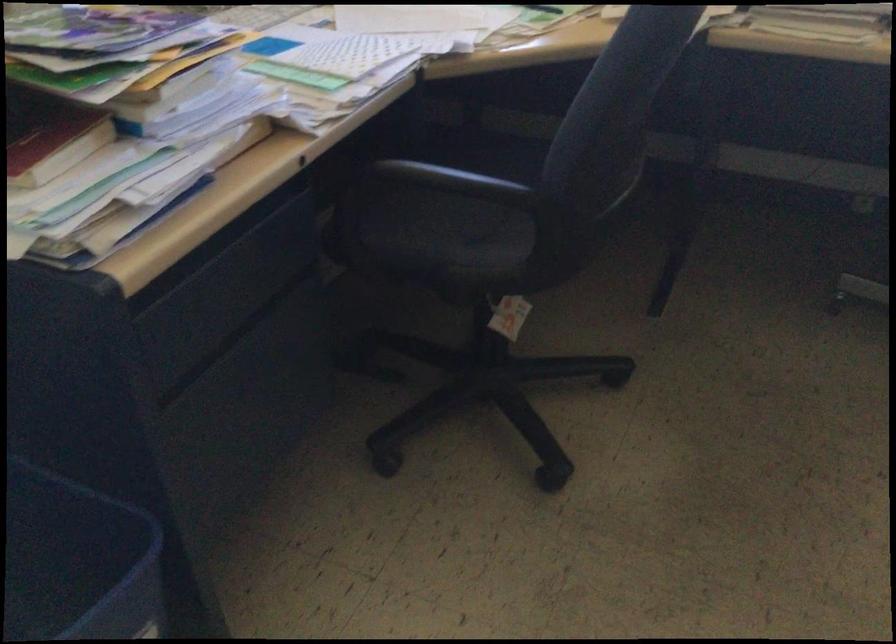
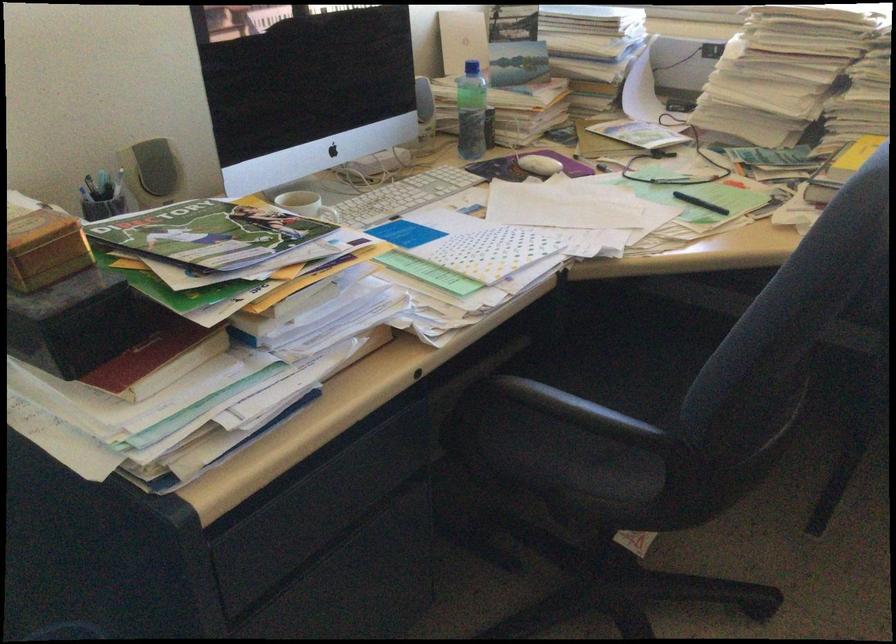
The point at (480, 167) is marked in the first image. Where is the corresponding point in the second image?

(618, 365)